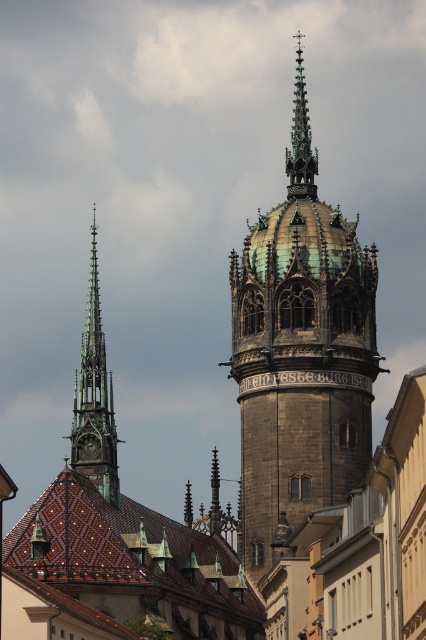
Who is shorter, dark brown stone tower at center or polished copper spire at upper center?

polished copper spire at upper center is shorter.

In order to click on dark brown stone tower at center in this screenshot , I will do `click(301, 355)`.

Which is in front, point (267, 432) or point (304, 97)?

Point (267, 432)

Where is `dark brown stone tower at center`? This screenshot has width=426, height=640. dark brown stone tower at center is located at coordinates (301, 355).

Is dark brown stone tower at center to the left of green copper spire at left from the viewer's perspective?

No, dark brown stone tower at center is not to the left of green copper spire at left.

Who is higher up, dark brown stone tower at center or green copper spire at left?

Positioned higher is dark brown stone tower at center.

This screenshot has width=426, height=640. Identify the location of dark brown stone tower at center. (301, 355).

This screenshot has width=426, height=640. What are the coordinates of `dark brown stone tower at center` in the screenshot? It's located at (301, 355).

Locate an element on the screen. green copper spire at left is located at coordinates (94, 401).

Is green copper spire at left smaller than polished copper spire at upper center?

Incorrect, green copper spire at left is not smaller in size than polished copper spire at upper center.

Between point (80, 436) and point (291, 141), which one is positioned in front?

Point (80, 436) is in front.

Identify the location of green copper spire at left. (94, 401).